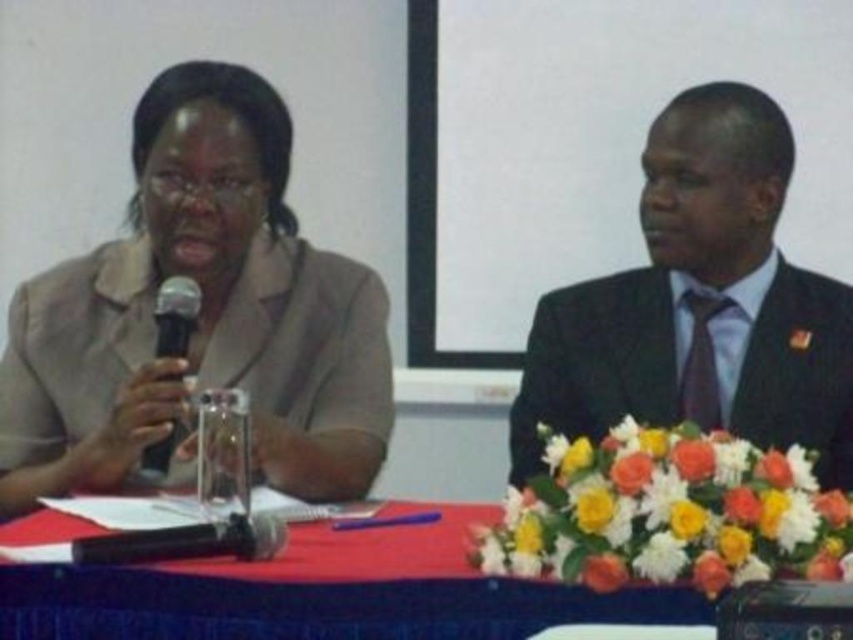
Question: Is matte beige blazer at left closer to camera compared to black matte microphone at left?

Choices:
 (A) no
 (B) yes

Answer: (B)

Question: Which object is positioned farthest from the black suit at right?

Choices:
 (A) black matte microphone at left
 (B) red fabric table at center
 (C) matte beige blazer at left

Answer: (A)

Question: Is red fabric table at center positioned in front of black matte microphone at left?

Choices:
 (A) yes
 (B) no

Answer: (A)

Question: Which object is closer to the camera taking this photo?

Choices:
 (A) matte beige blazer at left
 (B) black matte microphone at left
 (C) black suit at right

Answer: (A)

Question: Based on their relative distances, which object is farther from the black matte microphone at left?

Choices:
 (A) red fabric table at center
 (B) matte beige blazer at left
 (C) black suit at right

Answer: (C)

Question: Can you confirm if black suit at right is wider than black matte microphone at left?

Choices:
 (A) yes
 (B) no

Answer: (A)